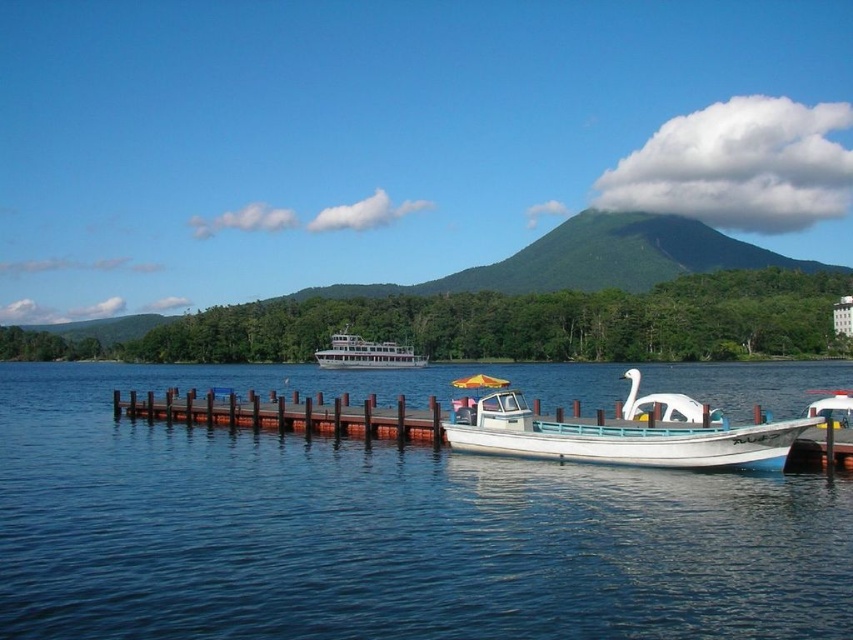
Question: Estimate the real-world distances between objects in this image. Which object is closer to the blue water at dock center?

Choices:
 (A) white matte boat at center
 (B) brown wooden dock at lower center
 (C) white glossy ferry at center

Answer: (A)

Question: Does brown wooden dock at lower center appear over white glossy ferry at center?

Choices:
 (A) yes
 (B) no

Answer: (B)

Question: Observing the image, what is the correct spatial positioning of white matte boat at center in reference to white glossy ferry at center?

Choices:
 (A) below
 (B) above

Answer: (A)

Question: Which point is closer to the camera?

Choices:
 (A) blue water at dock center
 (B) white glossy ferry at center
 (C) brown wooden dock at lower center
 (D) white matte boat at center

Answer: (A)

Question: Is white matte boat at center thinner than brown wooden dock at lower center?

Choices:
 (A) no
 (B) yes

Answer: (B)

Question: Which point is farther to the camera?

Choices:
 (A) white matte boat at center
 (B) blue water at dock center

Answer: (A)